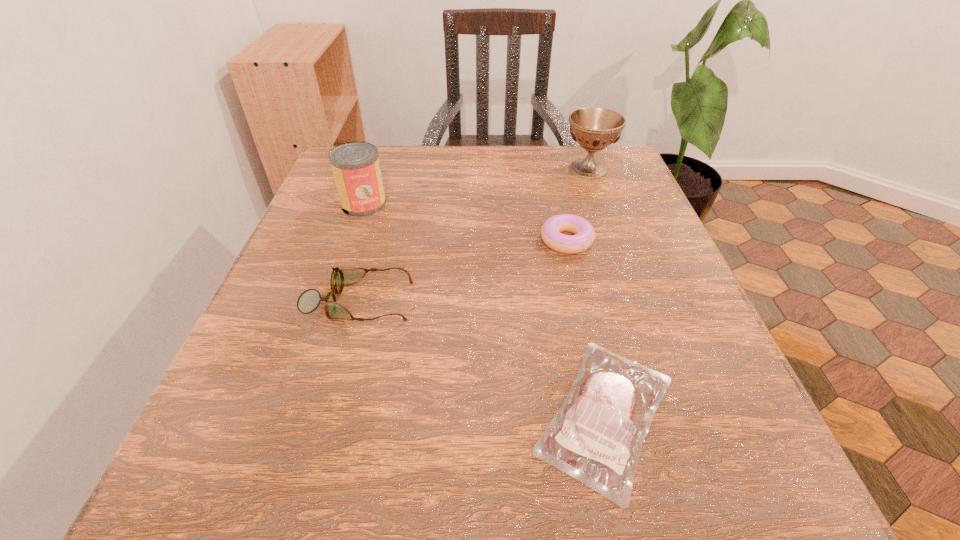
Image resolution: width=960 pixels, height=540 pixels. Identify the location of vacant region located 0.370m on the front-facing side of the spectacles. (634, 302).

The image size is (960, 540). What are the coordinates of `vacant space situated 0.100m on the front of the third farthest object` in the screenshot? It's located at (579, 296).

At what (x,y) coordinates should I click in order to perform the action: click on free space located on the left of the shortest object. Please return your answer as a coordinate pair (x, y). Looking at the image, I should click on (226, 415).

This screenshot has width=960, height=540. What are the coordinates of `chalice positioned at the far edge` in the screenshot? It's located at (594, 128).

Identify the location of can that is positioned at the far edge. This screenshot has height=540, width=960. (356, 169).

This screenshot has width=960, height=540. Find the location of `object that is at the near edge`. object that is at the near edge is located at coordinates (596, 437).

I want to click on can situated at the left edge, so click(356, 169).

This screenshot has width=960, height=540. What are the coordinates of `spectacles that is at the left edge` in the screenshot? It's located at pyautogui.click(x=309, y=300).

This screenshot has width=960, height=540. In order to click on chalice located at the right edge in this screenshot , I will do `click(594, 128)`.

Where is `doughnut that is at the right edge`? doughnut that is at the right edge is located at coordinates (584, 236).